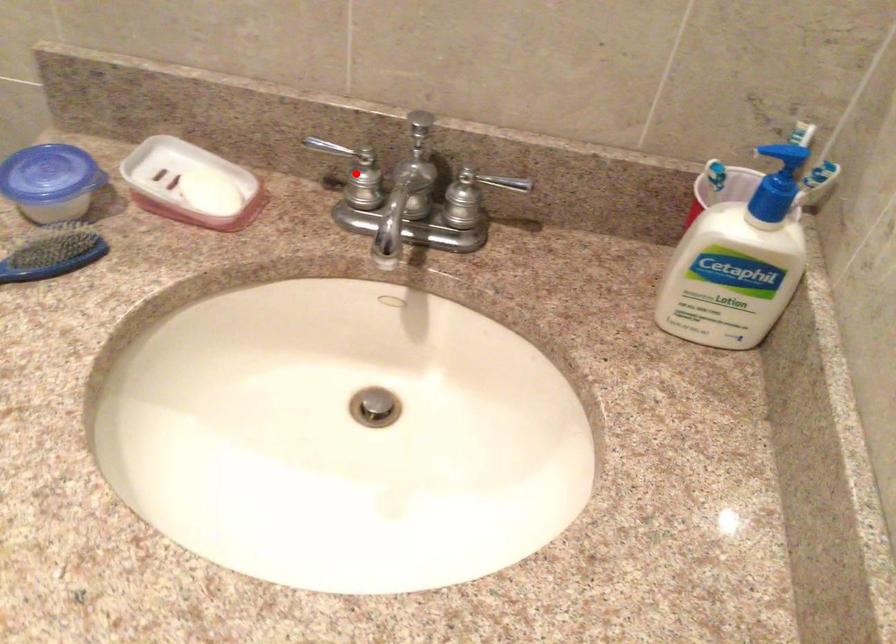
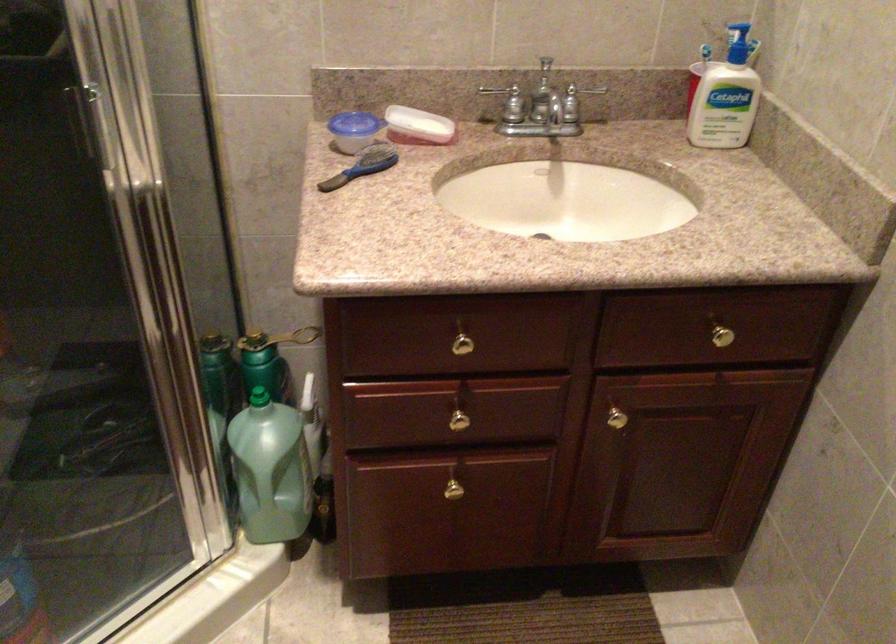
Question: I am providing you with two images of the same scene from different viewpoints. A red point is marked on the first image. Can you still see the location of the red point in image 2?

Choices:
 (A) Yes
 (B) No

Answer: (A)